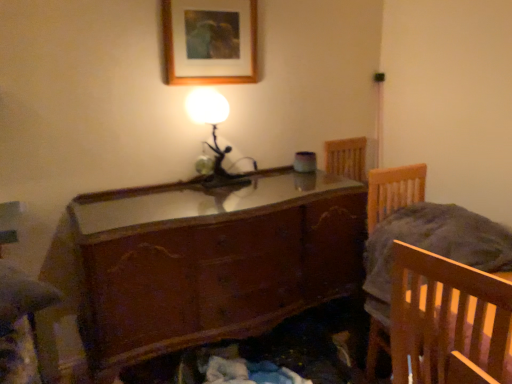
Question: Considering the relative sizes of wooden picture frame at upper center and wooden bed frame at right in the image provided, is wooden picture frame at upper center smaller than wooden bed frame at right?

Choices:
 (A) no
 (B) yes

Answer: (B)

Question: Considering the relative sizes of wooden picture frame at upper center and wooden bed frame at right in the image provided, is wooden picture frame at upper center shorter than wooden bed frame at right?

Choices:
 (A) no
 (B) yes

Answer: (B)

Question: Can you confirm if wooden picture frame at upper center is positioned to the right of wooden bed frame at right?

Choices:
 (A) yes
 (B) no

Answer: (B)

Question: Is wooden picture frame at upper center facing towards wooden bed frame at right?

Choices:
 (A) no
 (B) yes

Answer: (A)

Question: From a real-world perspective, is wooden picture frame at upper center located higher than wooden bed frame at right?

Choices:
 (A) yes
 (B) no

Answer: (A)

Question: Is wooden picture frame at upper center next to wooden bed frame at right?

Choices:
 (A) yes
 (B) no

Answer: (B)

Question: Is matte glass table lamp at upper center smaller than wooden picture frame at upper center?

Choices:
 (A) yes
 (B) no

Answer: (B)

Question: Is matte glass table lamp at upper center wider than wooden picture frame at upper center?

Choices:
 (A) yes
 (B) no

Answer: (A)

Question: Can you confirm if matte glass table lamp at upper center is shorter than wooden picture frame at upper center?

Choices:
 (A) no
 (B) yes

Answer: (A)

Question: Does matte glass table lamp at upper center have a lesser width compared to wooden picture frame at upper center?

Choices:
 (A) no
 (B) yes

Answer: (A)

Question: Can you confirm if matte glass table lamp at upper center is taller than wooden picture frame at upper center?

Choices:
 (A) no
 (B) yes

Answer: (B)

Question: Is matte glass table lamp at upper center to the left of wooden picture frame at upper center from the viewer's perspective?

Choices:
 (A) yes
 (B) no

Answer: (B)

Question: From the image's perspective, is wooden glossy chest of drawers at center under matte glass table lamp at upper center?

Choices:
 (A) no
 (B) yes

Answer: (B)